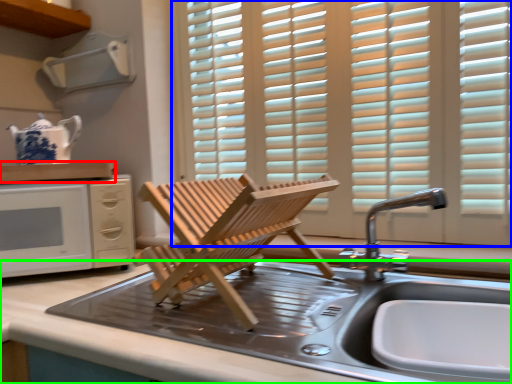
Question: Considering the real-world distances, which object is closest to countertop (highlighted by a red box)? window (highlighted by a blue box) or countertop (highlighted by a green box).

Choices:
 (A) window
 (B) countertop

Answer: (B)